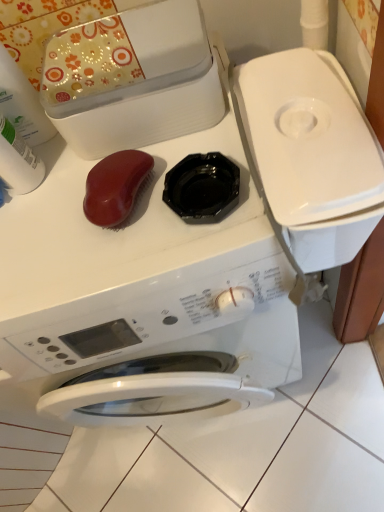
Question: Is white plastic bottle at upper left, which ranks as the second cleaning product in bottom-to-top order, turned away from white plastic bottle at left, placed as the 1th cleaning product when sorted from bottom to top?

Choices:
 (A) no
 (B) yes

Answer: (B)

Question: Is white plastic bottle at upper left, which ranks as the second cleaning product in bottom-to-top order, directly adjacent to white plastic bottle at left, marked as the 2th cleaning product in a top-to-bottom arrangement?

Choices:
 (A) yes
 (B) no

Answer: (A)

Question: From the image's perspective, does white plastic bottle at upper left, which is the 1th cleaning product from top to bottom, appear lower than white plastic bottle at left, marked as the 2th cleaning product in a top-to-bottom arrangement?

Choices:
 (A) yes
 (B) no

Answer: (B)

Question: Is white plastic bottle at upper left, which is the 1th cleaning product from top to bottom, wider than white plastic bottle at left, placed as the 1th cleaning product when sorted from bottom to top?

Choices:
 (A) no
 (B) yes

Answer: (A)

Question: Is white plastic bottle at upper left, which is the 1th cleaning product from top to bottom, bigger than white plastic bottle at left, placed as the 1th cleaning product when sorted from bottom to top?

Choices:
 (A) yes
 (B) no

Answer: (A)

Question: Considering the positions of white plastic bottle at upper left, which is the 1th cleaning product from top to bottom, and white glossy washing machine at center in the image, is white plastic bottle at upper left, which is the 1th cleaning product from top to bottom, taller or shorter than white glossy washing machine at center?

Choices:
 (A) short
 (B) tall

Answer: (A)

Question: Is white plastic bottle at upper left, which ranks as the second cleaning product in bottom-to-top order, to the left or to the right of white glossy washing machine at center in the image?

Choices:
 (A) left
 (B) right

Answer: (A)

Question: From a real-world perspective, relative to white glossy washing machine at center, is white plastic bottle at upper left, which is the 1th cleaning product from top to bottom, vertically above or below?

Choices:
 (A) above
 (B) below

Answer: (A)

Question: Considering their positions, is white plastic bottle at upper left, which is the 1th cleaning product from top to bottom, located in front of or behind white glossy washing machine at center?

Choices:
 (A) behind
 (B) front

Answer: (A)

Question: Is white plastic bottle at left, placed as the 1th cleaning product when sorted from bottom to top, taller or shorter than white plastic bottle at upper left, which is the 1th cleaning product from top to bottom?

Choices:
 (A) tall
 (B) short

Answer: (B)

Question: From the image's perspective, relative to white plastic bottle at upper left, which is the 1th cleaning product from top to bottom, is white plastic bottle at left, placed as the 1th cleaning product when sorted from bottom to top, above or below?

Choices:
 (A) above
 (B) below

Answer: (B)

Question: Considering the positions of white plastic bottle at left, placed as the 1th cleaning product when sorted from bottom to top, and white plastic bottle at upper left, which is the 1th cleaning product from top to bottom, in the image, is white plastic bottle at left, placed as the 1th cleaning product when sorted from bottom to top, bigger or smaller than white plastic bottle at upper left, which is the 1th cleaning product from top to bottom,?

Choices:
 (A) small
 (B) big

Answer: (A)

Question: Is white plastic bottle at left, placed as the 1th cleaning product when sorted from bottom to top, inside or outside of white plastic bottle at upper left, which ranks as the second cleaning product in bottom-to-top order?

Choices:
 (A) inside
 (B) outside

Answer: (B)

Question: Is white plastic bottle at upper left, which is the 1th cleaning product from top to bottom, situated inside white plastic bottle at left, marked as the 2th cleaning product in a top-to-bottom arrangement, or outside?

Choices:
 (A) outside
 (B) inside

Answer: (A)

Question: From a real-world perspective, is white plastic bottle at upper left, which is the 1th cleaning product from top to bottom, positioned above or below white plastic bottle at left, placed as the 1th cleaning product when sorted from bottom to top?

Choices:
 (A) above
 (B) below

Answer: (A)